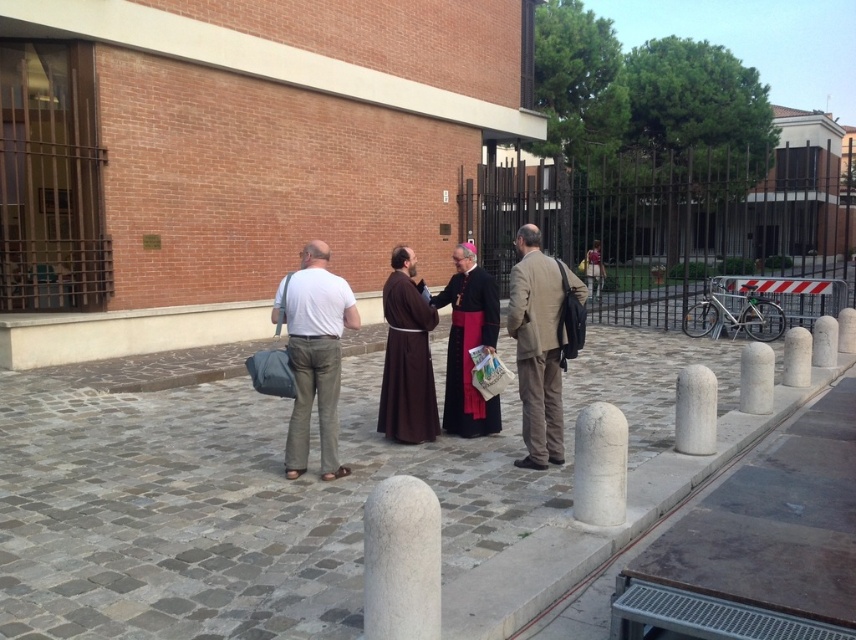
Can you confirm if gray cobblestone pavement at center is positioned below black velvet robe at center?

Indeed, gray cobblestone pavement at center is positioned under black velvet robe at center.

Between point (292, 579) and point (455, 396), which one is positioned in front?

Point (292, 579)

Where is `gray cobblestone pavement at center`? This screenshot has height=640, width=856. gray cobblestone pavement at center is located at coordinates (221, 509).

Does gray cobblestone pavement at center appear over brown leather robe at center?

Incorrect, gray cobblestone pavement at center is not positioned above brown leather robe at center.

Is point (339, 602) positioned after point (592, 294)?

No, (339, 602) is in front of (592, 294).

Describe the element at coordinates (221, 509) in the screenshot. I see `gray cobblestone pavement at center` at that location.

Locate an element on the screen. gray cobblestone pavement at center is located at coordinates [221, 509].

Between white cotton shirt at center and brown matte robe at center, which one is positioned lower?

Positioned lower is brown matte robe at center.

What do you see at coordinates (314, 356) in the screenshot? I see `white cotton shirt at center` at bounding box center [314, 356].

Identify the location of white cotton shirt at center. Image resolution: width=856 pixels, height=640 pixels. (314, 356).